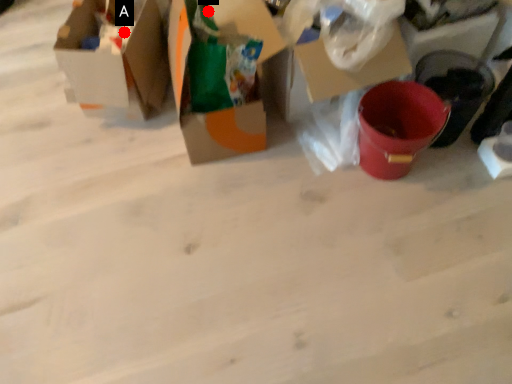
Question: Two points are circled on the image, labeled by A and B beside each circle. Which of the following is the closest to the observer?

Choices:
 (A) A is closer
 (B) B is closer

Answer: (B)